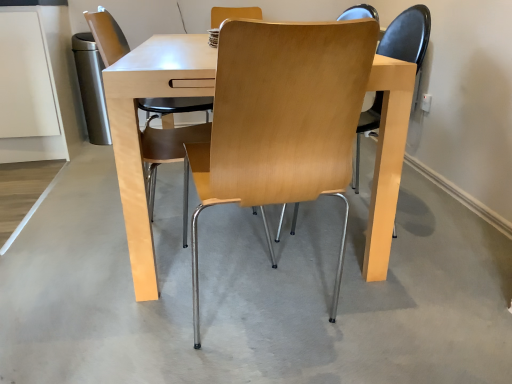
Find the location of a particular element. free location in front of light wood/matte chair at center, the 1th chair from the left is located at coordinates (116, 319).